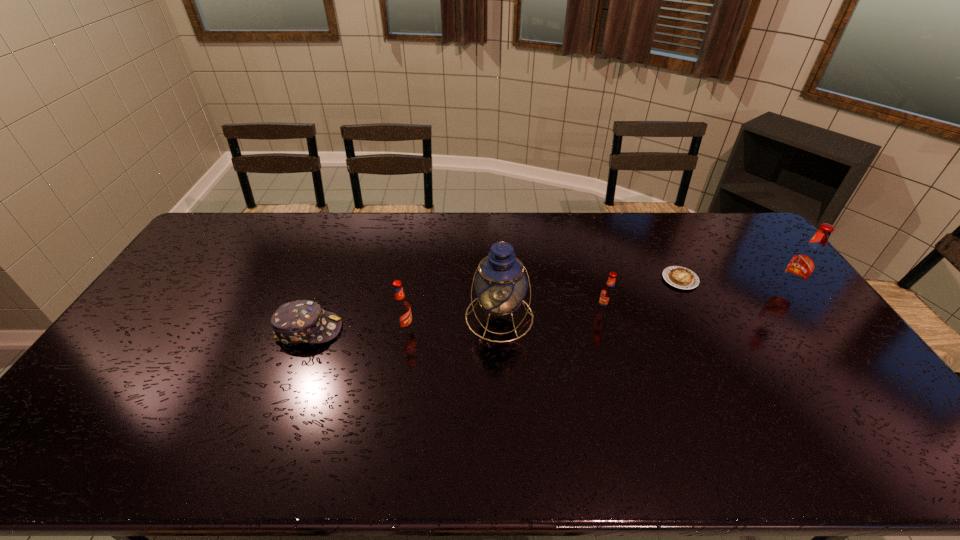
In order to click on unoccupied area between the rightmost root beer and the fourth object from right to left in this screenshot , I will do `click(643, 305)`.

Identify which object is the fourth closest to the nearest root beer. Please provide its 2D coordinates. Your answer should be formatted as a tuple, i.e. [(x, y)], where the tuple contains the x and y coordinates of a point satisfying the conditions above.

[(677, 276)]

You are a GUI agent. You are given a task and a screenshot of the screen. Output one action in this format:
    pyautogui.click(x=<x>, y=<y>)
    Task: Click on the closest object to the lantern
    The height and width of the screenshot is (540, 960).
    Given the screenshot: What is the action you would take?
    pyautogui.click(x=401, y=308)

You are a GUI agent. You are given a task and a screenshot of the screen. Output one action in this format:
    pyautogui.click(x=<x>, y=<y>)
    Task: Click on the root beer that is the third closest to the shortest object
    
    Given the screenshot: What is the action you would take?
    pyautogui.click(x=401, y=308)

The height and width of the screenshot is (540, 960). I want to click on root beer that is the nearest to the fifth object from left to right, so click(x=607, y=296).

Identify the location of vacant position in the image that satisfies the following two spatial constraints: 1. on the front side of the shortest object; 2. on the front-facing side of the leftmost object. The width and height of the screenshot is (960, 540). (706, 330).

This screenshot has height=540, width=960. Identify the location of vacant space that satisfies the following two spatial constraints: 1. on the front-facing side of the lantern; 2. on the front-facing side of the leftmost object. coord(500,330).

The image size is (960, 540). I want to click on free space that satisfies the following two spatial constraints: 1. on the front side of the quiche; 2. on the right side of the rightmost root beer, so click(x=686, y=292).